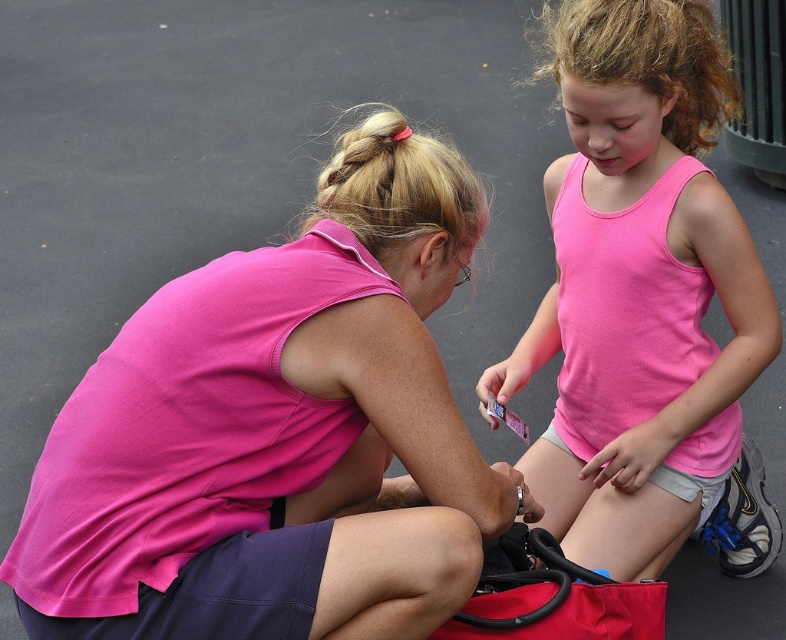
Question: Among these points, which one is farthest from the camera?

Choices:
 (A) (53, 532)
 (B) (670, 275)

Answer: (B)

Question: Which point is closer to the camera taking this photo?

Choices:
 (A) (691, 40)
 (B) (57, 464)

Answer: (B)

Question: Which point is farther to the camera?

Choices:
 (A) pink matte tank top at center
 (B) pink fabric shirt at center

Answer: (A)

Question: Does pink fabric shirt at center have a greater width compared to pink matte tank top at center?

Choices:
 (A) yes
 (B) no

Answer: (A)

Question: Can you confirm if pink fabric shirt at center is positioned to the left of pink matte tank top at center?

Choices:
 (A) yes
 (B) no

Answer: (A)

Question: Does pink fabric shirt at center appear on the left side of pink matte tank top at center?

Choices:
 (A) yes
 (B) no

Answer: (A)